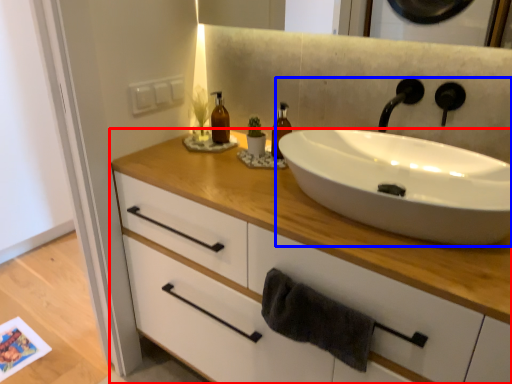
Question: Among these objects, which one is farthest to the camera, bathroom cabinet (highlighted by a red box) or sink (highlighted by a blue box)?

Choices:
 (A) bathroom cabinet
 (B) sink

Answer: (B)